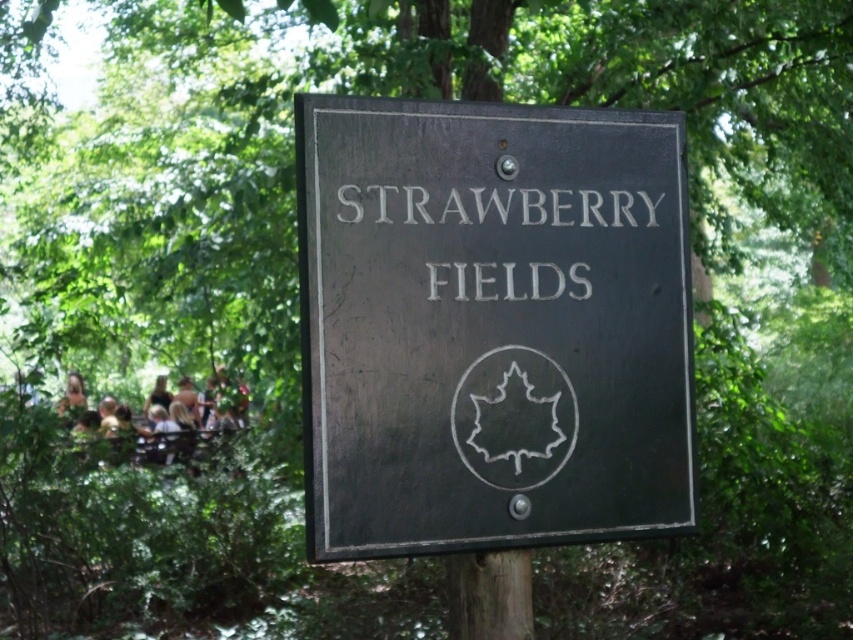
Question: Is matte black sign at center above white painted text at center?

Choices:
 (A) yes
 (B) no

Answer: (B)

Question: Which object is farther from the camera taking this photo?

Choices:
 (A) white painted text at center
 (B) matte black sign at center

Answer: (A)

Question: Can you confirm if matte black sign at center is positioned below white painted text at center?

Choices:
 (A) yes
 (B) no

Answer: (A)

Question: Among these objects, which one is farthest from the camera?

Choices:
 (A) white painted text at center
 (B) matte black sign at center

Answer: (A)

Question: Which object appears farthest from the camera in this image?

Choices:
 (A) matte black sign at center
 (B) white painted text at center

Answer: (B)

Question: Does matte black sign at center appear over white painted text at center?

Choices:
 (A) yes
 (B) no

Answer: (B)